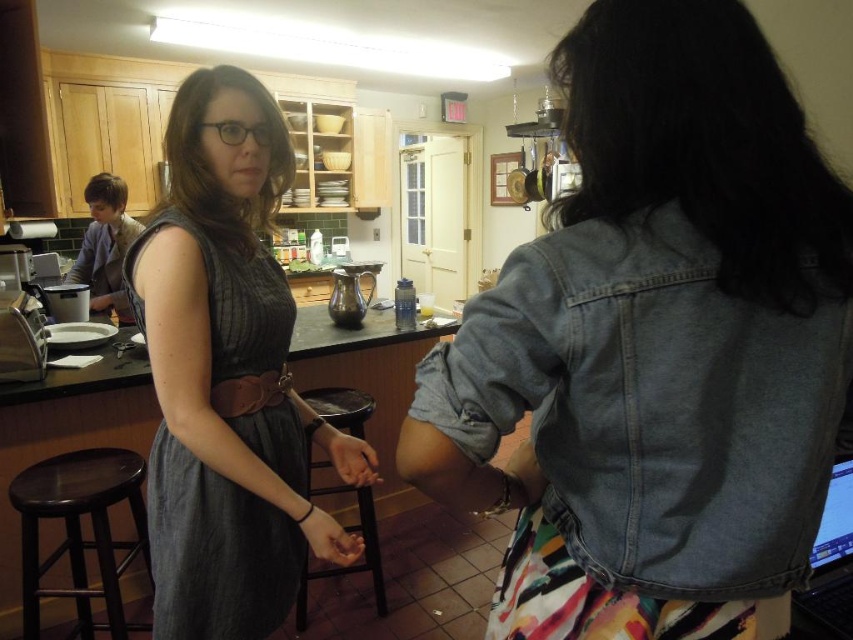
You are a delivery person who needs to place a small package on a surface in the kitchen. You see the black glossy laptop at lower right and the matte skin hand at center. Which surface can you use to place the package without it being obstructed by the hand?

The black glossy laptop at lower right is taller than the matte skin hand at center, so placing the package on the laptop surface would keep it above the hand, avoiding obstruction.

You are trying to reach the black glossy laptop at lower right to grab a pen. However, there is a matte skin hand at center in the way. Can you move your hand to access the laptop without touching the other person?

The black glossy laptop at lower right is positioned over matte skin hand at center, so you can move your hand to access the laptop without touching the other person as the laptop is above the hand.

You are organizing a clothing display and need to place the gray linen dress at center and the brown leather belt at center on a mannequin. What is the minimum distance you should leave between them to ensure they are placed according to the image?

The minimum distance you should leave between the gray linen dress at center and the brown leather belt at center is 16.00 centimeters to match their placement in the image.